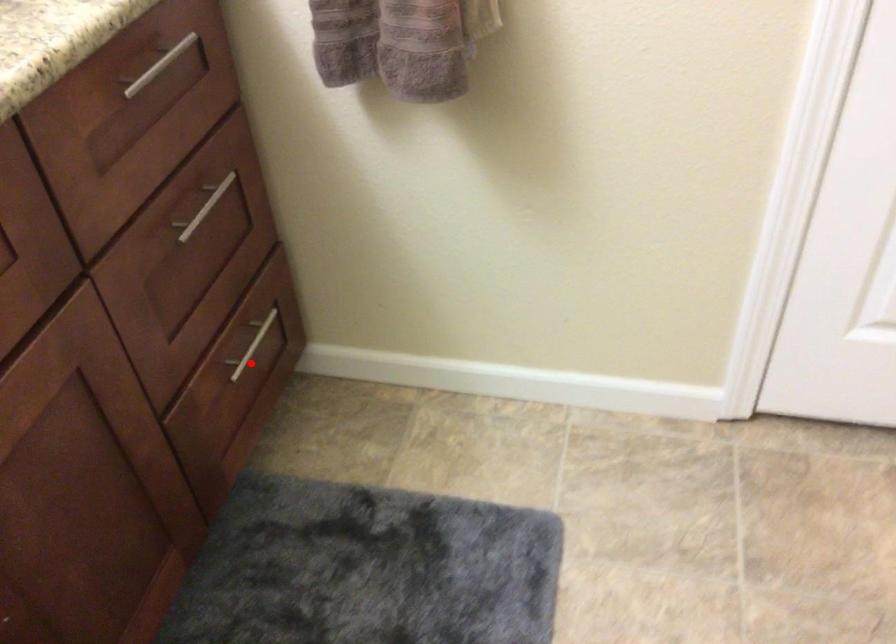
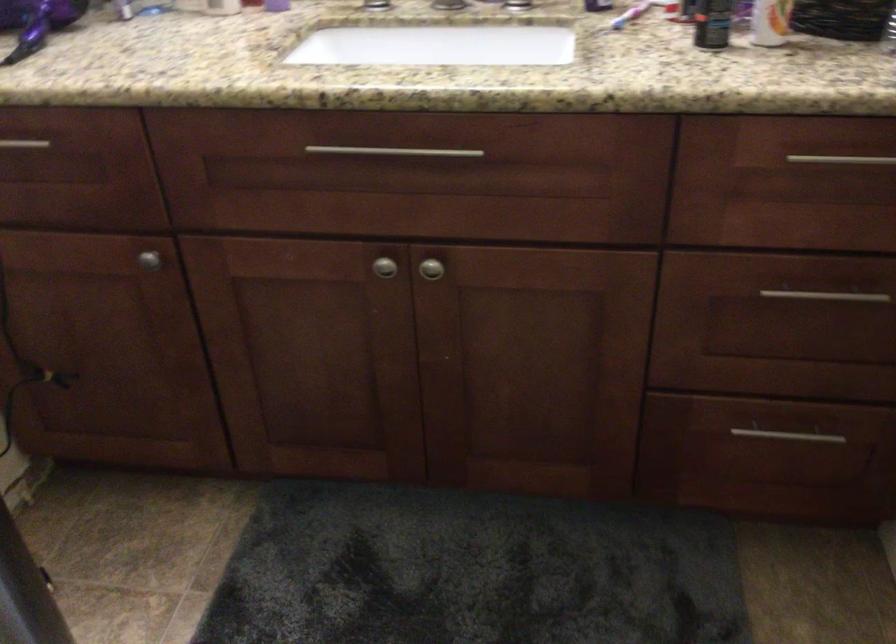
Locate, in the second image, the point that corresponds to the highlighted location in the first image.

(778, 446)